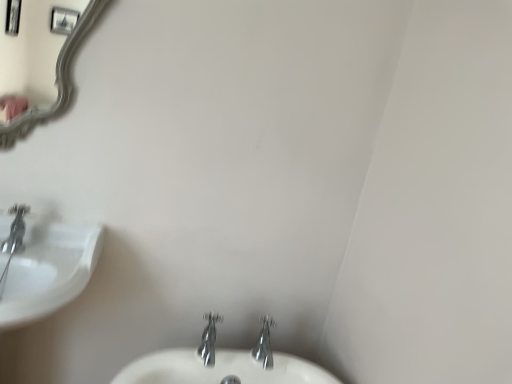
Question: Does polished chrome faucet at center, which ranks as the 1th tap in left-to-right order, lie in front of chrome metallic faucet at lower center, placed as the 1th tap when sorted from right to left?

Choices:
 (A) no
 (B) yes

Answer: (B)

Question: From a real-world perspective, is polished chrome faucet at center, the second tap when ordered from right to left, on chrome metallic faucet at lower center, arranged as the 2th tap when viewed from the left?

Choices:
 (A) yes
 (B) no

Answer: (B)

Question: Is polished chrome faucet at center, which ranks as the 1th tap in left-to-right order, positioned beyond the bounds of chrome metallic faucet at lower center, arranged as the 2th tap when viewed from the left?

Choices:
 (A) yes
 (B) no

Answer: (A)

Question: Considering the relative sizes of polished chrome faucet at center, which ranks as the 1th tap in left-to-right order, and chrome metallic faucet at lower center, arranged as the 2th tap when viewed from the left, in the image provided, is polished chrome faucet at center, which ranks as the 1th tap in left-to-right order, taller than chrome metallic faucet at lower center, arranged as the 2th tap when viewed from the left,?

Choices:
 (A) no
 (B) yes

Answer: (A)

Question: Is polished chrome faucet at center, the second tap when ordered from right to left, positioned with its back to chrome metallic faucet at lower center, placed as the 1th tap when sorted from right to left?

Choices:
 (A) no
 (B) yes

Answer: (A)

Question: Is polished chrome faucet at center, which ranks as the 1th tap in left-to-right order, at the right side of chrome metallic faucet at lower center, arranged as the 2th tap when viewed from the left?

Choices:
 (A) yes
 (B) no

Answer: (B)

Question: Is chrome metallic faucet at lower center, arranged as the 2th tap when viewed from the left, positioned beyond the bounds of white glossy sink at left?

Choices:
 (A) no
 (B) yes

Answer: (B)

Question: From a real-world perspective, is chrome metallic faucet at lower center, placed as the 1th tap when sorted from right to left, physically below white glossy sink at left?

Choices:
 (A) yes
 (B) no

Answer: (B)

Question: From a real-world perspective, is chrome metallic faucet at lower center, placed as the 1th tap when sorted from right to left, located higher than white glossy sink at left?

Choices:
 (A) no
 (B) yes

Answer: (B)

Question: Considering the relative sizes of chrome metallic faucet at lower center, arranged as the 2th tap when viewed from the left, and white glossy sink at left in the image provided, is chrome metallic faucet at lower center, arranged as the 2th tap when viewed from the left, bigger than white glossy sink at left?

Choices:
 (A) yes
 (B) no

Answer: (B)

Question: Is chrome metallic faucet at lower center, arranged as the 2th tap when viewed from the left, oriented away from white glossy sink at left?

Choices:
 (A) yes
 (B) no

Answer: (B)

Question: From the image's perspective, is chrome metallic faucet at lower center, placed as the 1th tap when sorted from right to left, above white glossy sink at left?

Choices:
 (A) yes
 (B) no

Answer: (B)

Question: Is polished chrome faucet at center, which ranks as the 1th tap in left-to-right order, located outside white glossy sink at left?

Choices:
 (A) no
 (B) yes

Answer: (B)